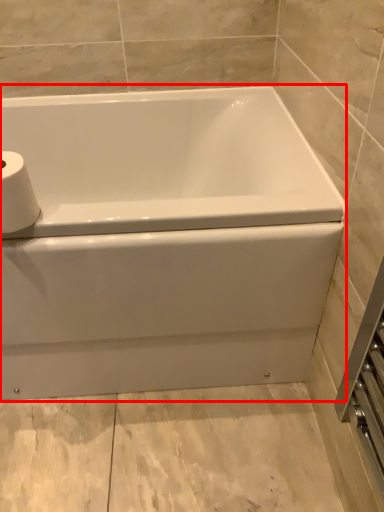
Question: From the image, what is the correct spatial relationship of bathtub (annotated by the red box) in relation to toilet paper?

Choices:
 (A) right
 (B) left

Answer: (A)